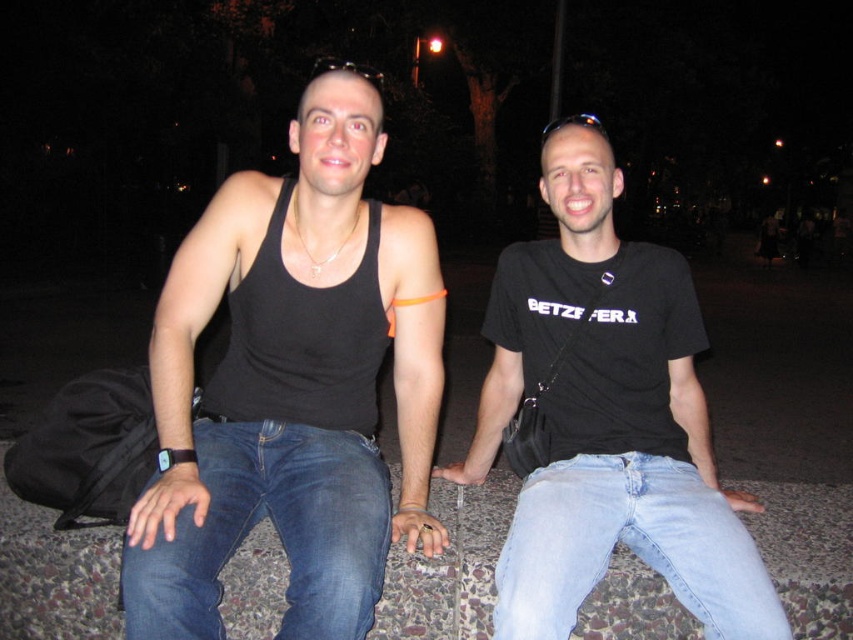
Question: From the image, what is the correct spatial relationship of black cotton t-shirt at center in relation to light blue denim jeans at lower right?

Choices:
 (A) below
 (B) above

Answer: (B)

Question: Does black matte tank top at left appear on the left side of black cotton t-shirt at center?

Choices:
 (A) no
 (B) yes

Answer: (B)

Question: Considering the relative positions of black matte tank top at center and black cotton t-shirt at center in the image provided, where is black matte tank top at center located with respect to black cotton t-shirt at center?

Choices:
 (A) left
 (B) right

Answer: (A)

Question: Among these objects, which one is farthest from the camera?

Choices:
 (A) black cotton t-shirt at center
 (B) black matte tank top at left
 (C) black matte tank top at center
 (D) denim jeans at lower left

Answer: (A)

Question: Which point appears farthest from the camera in this image?

Choices:
 (A) (520, 534)
 (B) (218, 496)
 (C) (640, 493)
 (D) (440, 538)

Answer: (D)

Question: Among these points, which one is nearest to the camera?

Choices:
 (A) (407, 483)
 (B) (216, 522)
 (C) (672, 536)

Answer: (B)